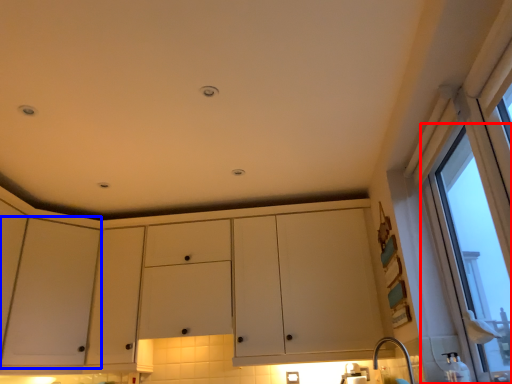
Question: Which point is closer to the camera, window (highlighted by a red box) or screen door (highlighted by a blue box)?

Choices:
 (A) window
 (B) screen door

Answer: (A)